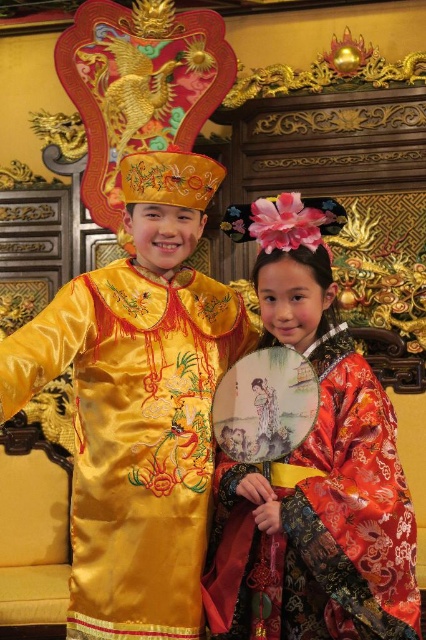
Question: Which of the following is the closest to the observer?

Choices:
 (A) (161, 417)
 (B) (224, 620)

Answer: (B)

Question: Does satin yellow robe at center appear on the left side of silky red dress at center?

Choices:
 (A) yes
 (B) no

Answer: (A)

Question: Does satin yellow robe at center appear on the left side of silky red dress at center?

Choices:
 (A) yes
 (B) no

Answer: (A)

Question: Which point is closer to the camera?

Choices:
 (A) satin yellow robe at center
 (B) silky red dress at center

Answer: (B)

Question: Does satin yellow robe at center have a larger size compared to silky red dress at center?

Choices:
 (A) no
 (B) yes

Answer: (B)